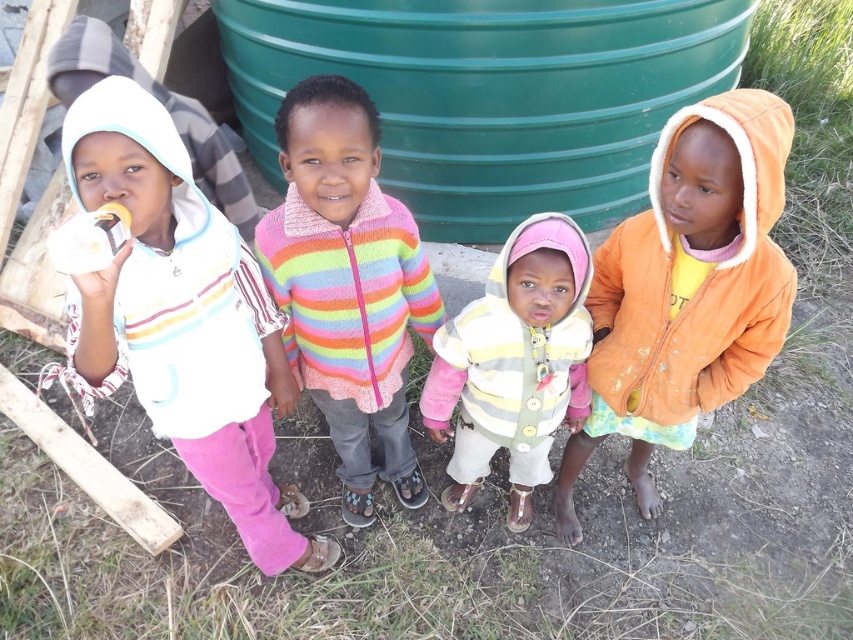
Question: Does white fleece hoodie at left appear on the left side of multicolored knitted sweater at center?

Choices:
 (A) no
 (B) yes

Answer: (B)

Question: Estimate the real-world distances between objects in this image. Which object is closer to the white fleece hoodie at left?

Choices:
 (A) striped knit sweater at center
 (B) orange fleece jacket at right

Answer: (A)

Question: Which point is farther from the camera taking this photo?

Choices:
 (A) (415, 156)
 (B) (723, 108)
 (C) (451, 333)

Answer: (A)

Question: Which object appears closest to the camera in this image?

Choices:
 (A) green plastic barrel at upper center
 (B) striped knit sweater at center

Answer: (B)

Question: Does green plastic barrel at upper center appear on the right side of striped knit sweater at center?

Choices:
 (A) yes
 (B) no

Answer: (B)

Question: Is orange fleece jacket at right wider than striped knit sweater at center?

Choices:
 (A) no
 (B) yes

Answer: (A)